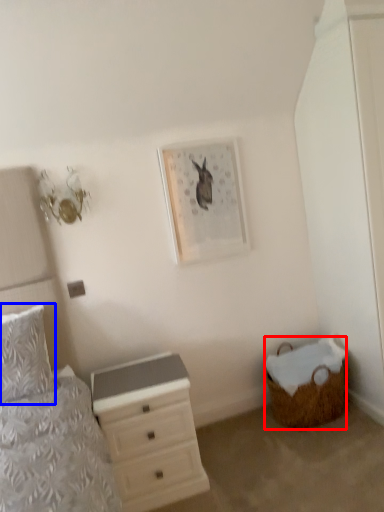
Question: Among these objects, which one is farthest to the camera, basket (highlighted by a red box) or pillow (highlighted by a blue box)?

Choices:
 (A) basket
 (B) pillow

Answer: (A)